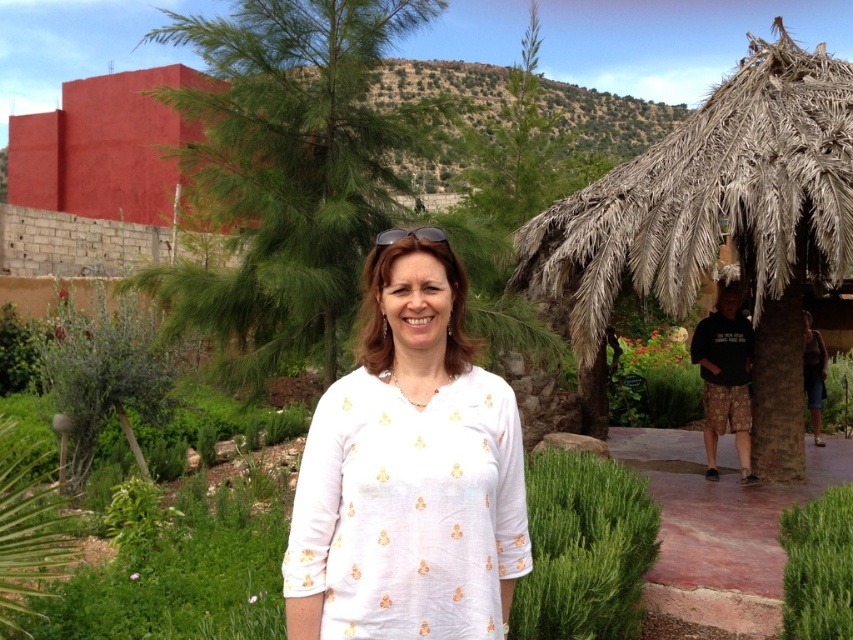
In the scene shown: You are a painter standing in the garden scene and want to paint the smooth red wall at upper left. Where exactly should you position yourself to capture the wall in your painting?

The smooth red wall at upper left is located at coordinates point (103, 147), so you should position yourself at that point to include it in your painting.

You are a painter who wants to hang a picture frame on the wall. You have a picture frame that is exactly the same size as the clear plastic goggles at center. Will the smooth red wall at upper left have enough space to fit the frame?

The smooth red wall at upper left is located above the clear plastic goggles at center, so there is sufficient space to fit the picture frame of the same size as the clear plastic goggles at center on the smooth red wall at upper left.

You are a painter who wants to paint the smooth red wall at upper left and the white cotton blouse at center. Since you want to focus on the background first, which object should you paint first?

The smooth red wall at upper left should be painted first because it is positioned over the white cotton blouse at center, making it part of the background.